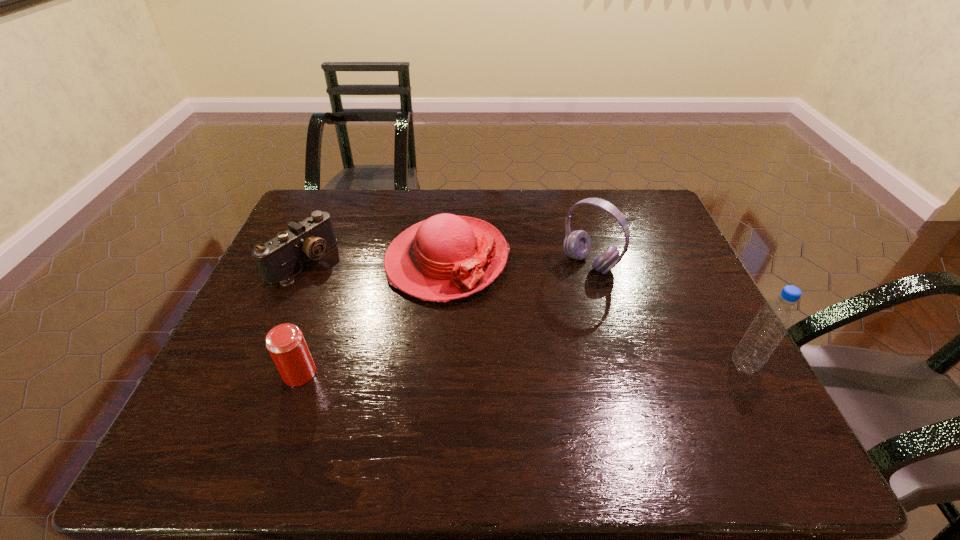
Locate an element on the screen. This screenshot has height=540, width=960. free space that satisfies the following two spatial constraints: 1. on the back side of the beer can; 2. on the right side of the hat is located at coordinates (340, 260).

Find the location of `free location that satisfies the following two spatial constraints: 1. on the front side of the headset; 2. on the right side of the camera`. free location that satisfies the following two spatial constraints: 1. on the front side of the headset; 2. on the right side of the camera is located at coordinates (301, 264).

Where is `free space in the image that satisfies the following two spatial constraints: 1. on the front side of the camera; 2. on the right side of the rightmost object`? The image size is (960, 540). free space in the image that satisfies the following two spatial constraints: 1. on the front side of the camera; 2. on the right side of the rightmost object is located at coordinates (255, 366).

At what (x,y) coordinates should I click in order to perform the action: click on free spot that satisfies the following two spatial constraints: 1. on the front side of the hat; 2. on the right side of the headset. Please return your answer as a coordinate pair (x, y). Looking at the image, I should click on (446, 264).